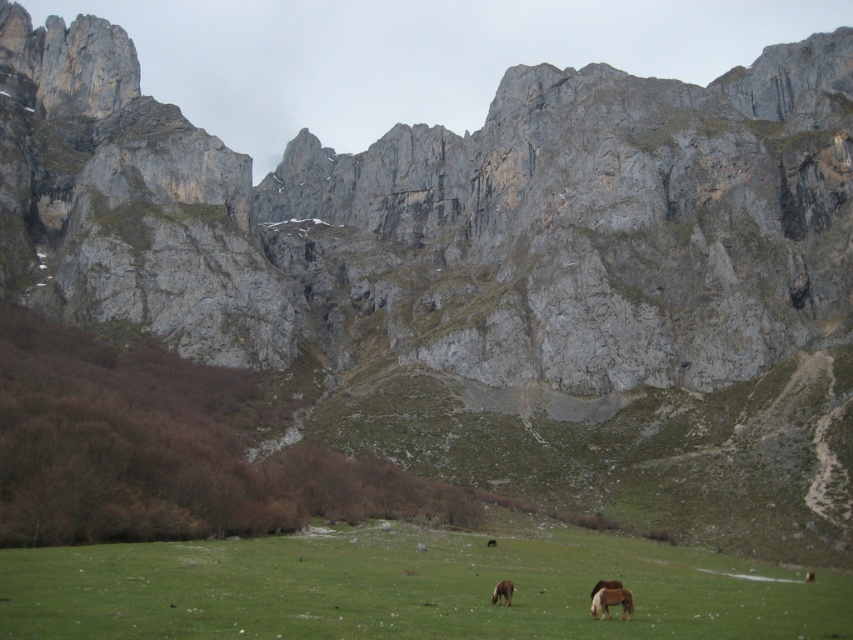
You are a GUI agent. You are given a task and a screenshot of the screen. Output one action in this format:
    pyautogui.click(x=<x>, y=<y>)
    Task: Click on the brown fuzzy horse at lower center
    Image resolution: width=853 pixels, height=640 pixels.
    Given the screenshot: What is the action you would take?
    pyautogui.click(x=611, y=602)

This screenshot has width=853, height=640. Find the location of `brown fuzzy horse at lower center`. brown fuzzy horse at lower center is located at coordinates (611, 602).

Who is taller, green grass pasture at lower center or brown fuzzy horse at lower center?

Standing taller between the two is green grass pasture at lower center.

You are a GUI agent. You are given a task and a screenshot of the screen. Output one action in this format:
    pyautogui.click(x=<x>, y=<y>)
    Task: Click on the green grass pasture at lower center
    The height and width of the screenshot is (640, 853).
    Given the screenshot: What is the action you would take?
    pyautogui.click(x=408, y=588)

Is point (834, 628) positioned in front of point (593, 608)?

Yes, it is in front of point (593, 608).

At what (x,y) coordinates should I click in order to perform the action: click on green grass pasture at lower center. Please return your answer as a coordinate pair (x, y). Looking at the image, I should click on (408, 588).

Is green grass pasture at lower center below brown matte horse at center?

Indeed, green grass pasture at lower center is positioned under brown matte horse at center.

Does point (666, 550) come behind point (500, 595)?

Yes, it is behind point (500, 595).

Is point (286, 589) closer to camera compared to point (502, 592)?

That is True.

Locate an element on the screen. Image resolution: width=853 pixels, height=640 pixels. green grass pasture at lower center is located at coordinates (408, 588).